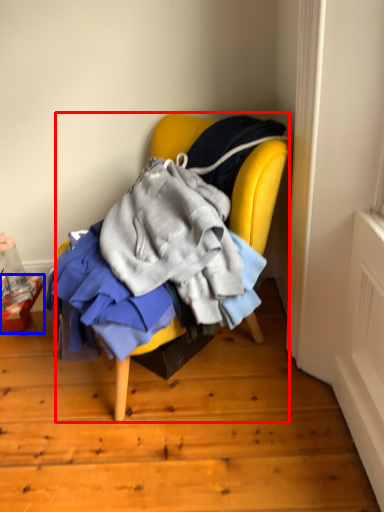
Question: Which of the following is the closest to the observer, chair (highlighted by a red box) or box (highlighted by a blue box)?

Choices:
 (A) chair
 (B) box

Answer: (A)